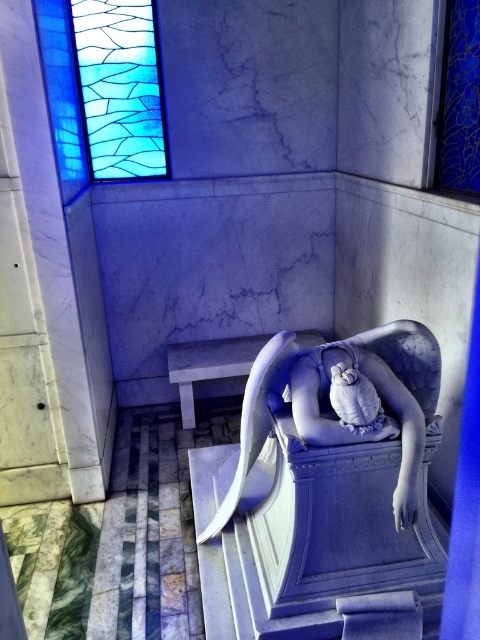
You are standing in the church and want to place a 3.5 feet wide flower arrangement exactly at the point labeled point (347, 365). Can you fit it there without moving any other objects?

The point labeled point (347, 365) is 6.26 feet away from you. Since the flower arrangement is 3.5 feet wide, there is enough space to fit it at that location without moving other objects.

You are standing in the center of the church and want to place a new candle holder exactly at the point marked by the coordinates point (372,396). However, there is already an object there. What is the object currently occupying that location?

The point (372,396) is occupied by the satin blue statue at center.

You are standing at the entrance of the church and want to locate the white marble statue at center. According to the coordinates provided, in which direction should you walk to reach it?

The white marble statue at center is located at coordinates point (323, 492), so you should walk towards the center of the image to reach it.